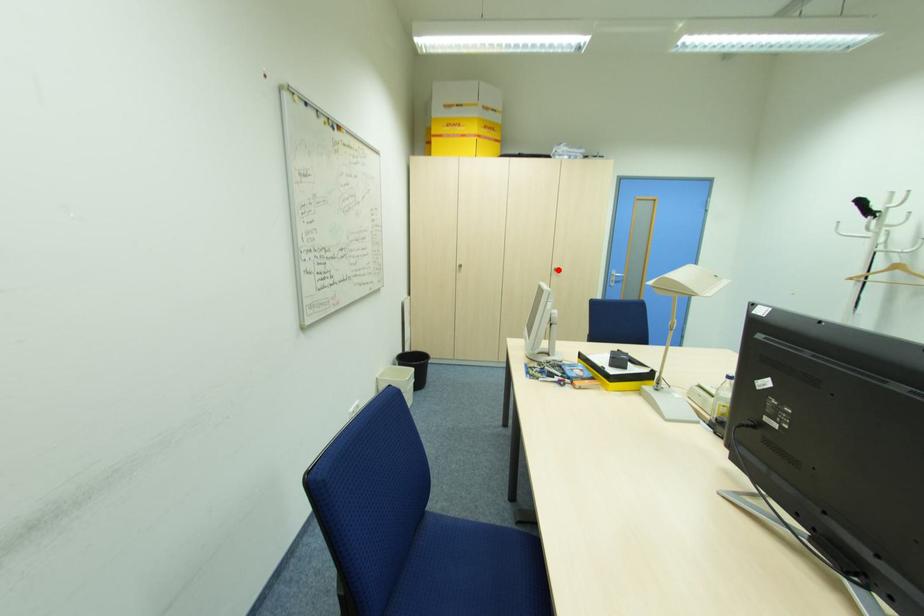
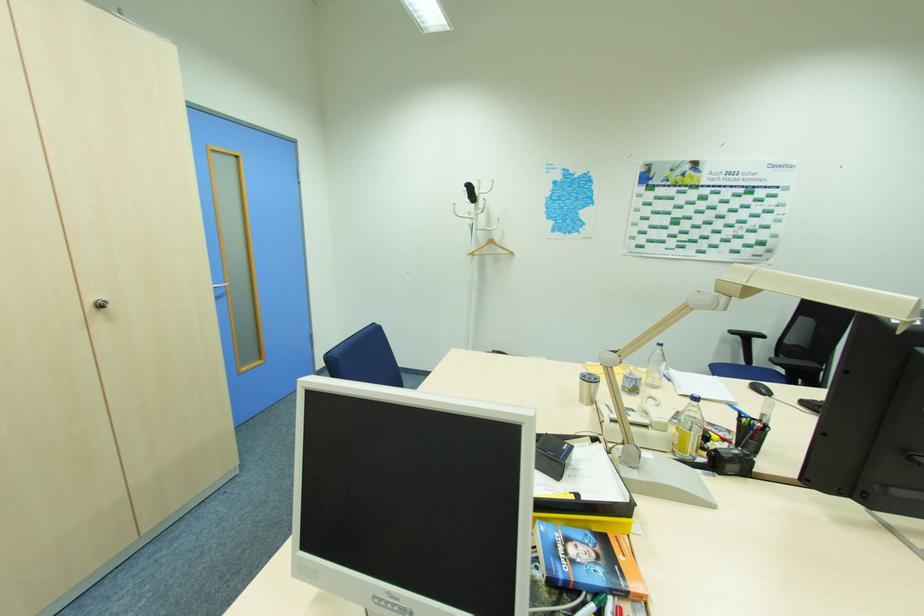
Where in the second image is the point corresponding to the highlighted location from the first image?

(103, 306)